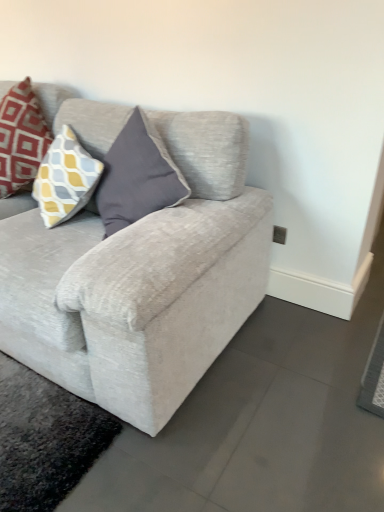
Locate an element on the screen. The height and width of the screenshot is (512, 384). light gray fabric couch at center is located at coordinates (141, 280).

The height and width of the screenshot is (512, 384). Describe the element at coordinates (141, 280) in the screenshot. I see `light gray fabric couch at center` at that location.

Where is `matte red pillow at upper left`? This screenshot has height=512, width=384. matte red pillow at upper left is located at coordinates (21, 137).

The image size is (384, 512). Describe the element at coordinates (21, 137) in the screenshot. I see `matte red pillow at upper left` at that location.

What is the approximate height of matte red pillow at upper left?

20.28 inches.

This screenshot has width=384, height=512. Identify the location of light gray fabric couch at center. (141, 280).

Between light gray fabric couch at center and matte red pillow at upper left, which one appears on the left side from the viewer's perspective?

Positioned to the left is matte red pillow at upper left.

Based on the photo, is the depth of light gray fabric couch at center less than that of matte red pillow at upper left?

Yes, the depth of light gray fabric couch at center is less than that of matte red pillow at upper left.

Is point (200, 315) positioned in front of point (1, 119)?

Yes, point (200, 315) is closer to viewer.

From the image's perspective, who appears lower, light gray fabric couch at center or matte red pillow at upper left?

light gray fabric couch at center appears lower in the image.

From a real-world perspective, is light gray fabric couch at center positioned over matte red pillow at upper left based on gravity?

No, from a real-world perspective, light gray fabric couch at center is not on top of matte red pillow at upper left.

Considering the sizes of objects light gray fabric couch at center and matte red pillow at upper left in the image provided, who is thinner, light gray fabric couch at center or matte red pillow at upper left?

With smaller width is matte red pillow at upper left.

Who is taller, light gray fabric couch at center or matte red pillow at upper left?

Standing taller between the two is light gray fabric couch at center.

Who is smaller, light gray fabric couch at center or matte red pillow at upper left?

matte red pillow at upper left is smaller.

Is light gray fabric couch at center spatially inside matte red pillow at upper left, or outside of it?

light gray fabric couch at center is not enclosed by matte red pillow at upper left.

Can you see light gray fabric couch at center touching matte red pillow at upper left?

light gray fabric couch at center is not next to matte red pillow at upper left, and they're not touching.

Is light gray fabric couch at center aimed at matte red pillow at upper left?

No, light gray fabric couch at center is not oriented towards matte red pillow at upper left.

What's the angular difference between light gray fabric couch at center and matte red pillow at upper left's facing directions?

0.049 degrees separate the facing orientations of light gray fabric couch at center and matte red pillow at upper left.

In the scene shown: Measure the distance from light gray fabric couch at center to matte red pillow at upper left.

24.28 inches.

Locate an element on the screen. This screenshot has width=384, height=512. studio couch on the right of the matte red pillow at upper left is located at coordinates (141, 280).

Which is more to the left, matte red pillow at upper left or light gray fabric couch at center?

From the viewer's perspective, matte red pillow at upper left appears more on the left side.

Which is in front, matte red pillow at upper left or light gray fabric couch at center?

light gray fabric couch at center.

Which is nearer, (34, 146) or (128, 366)?

The point (128, 366) is closer to the camera.

From the image's perspective, between matte red pillow at upper left and light gray fabric couch at center, which one is located above?

From the image's view, matte red pillow at upper left is above.

From a real-world perspective, relative to light gray fabric couch at center, is matte red pillow at upper left vertically above or below?

matte red pillow at upper left is situated higher than light gray fabric couch at center in the real world.

Considering the relative sizes of matte red pillow at upper left and light gray fabric couch at center in the image provided, is matte red pillow at upper left wider than light gray fabric couch at center?

No, matte red pillow at upper left is not wider than light gray fabric couch at center.

Which of these two, matte red pillow at upper left or light gray fabric couch at center, stands taller?

light gray fabric couch at center.

Between matte red pillow at upper left and light gray fabric couch at center, which one has larger size?

light gray fabric couch at center.

Is matte red pillow at upper left inside the boundaries of light gray fabric couch at center, or outside?

matte red pillow at upper left lies within the bounds of light gray fabric couch at center.

Would you say matte red pillow at upper left is a long distance from light gray fabric couch at center?

They are positioned close to each other.

Is matte red pillow at upper left oriented towards light gray fabric couch at center?

Yes.

How many degrees apart are the facing directions of matte red pillow at upper left and light gray fabric couch at center?

0.049 degrees.

How distant is matte red pillow at upper left from light gray fabric couch at center?

A distance of 24.28 inches exists between matte red pillow at upper left and light gray fabric couch at center.

Identify the location of studio couch on the right side of matte red pillow at upper left. (141, 280).

This screenshot has width=384, height=512. What are the coordinates of `pillow above the light gray fabric couch at center (from the image's perspective)` in the screenshot? It's located at (21, 137).

Find the location of a particular element. The image size is (384, 512). studio couch below the matte red pillow at upper left (from the image's perspective) is located at coordinates (141, 280).